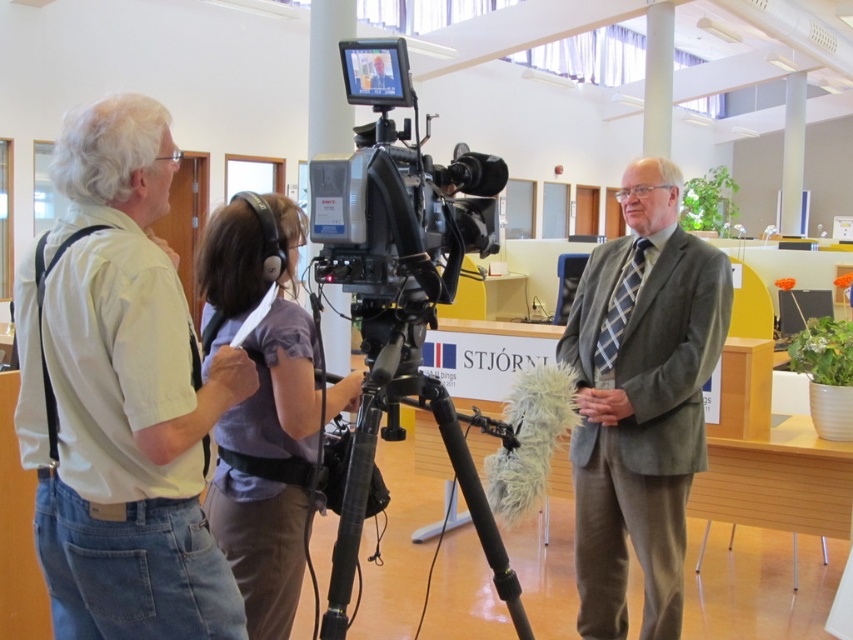
Which is above, gray wool suit at center or black plastic video camera at center?

black plastic video camera at center

Is gray wool suit at center smaller than black plastic video camera at center?

No.

The image size is (853, 640). Find the location of `gray wool suit at center`. gray wool suit at center is located at coordinates (640, 401).

The image size is (853, 640). I want to click on gray wool suit at center, so click(x=640, y=401).

Who is shorter, light beige shirt at left or black metal tripod at center?

With less height is black metal tripod at center.

Is light beige shirt at left to the left of black metal tripod at center from the viewer's perspective?

Correct, you'll find light beige shirt at left to the left of black metal tripod at center.

This screenshot has width=853, height=640. What do you see at coordinates (120, 396) in the screenshot?
I see `light beige shirt at left` at bounding box center [120, 396].

The width and height of the screenshot is (853, 640). Identify the location of light beige shirt at left. [x=120, y=396].

Is point (389, 131) behind point (372, 397)?

No, (389, 131) is in front of (372, 397).

Identify the location of black plastic video camera at center. Image resolution: width=853 pixels, height=640 pixels. (397, 196).

Where is `black plastic video camera at center`? black plastic video camera at center is located at coordinates coord(397,196).